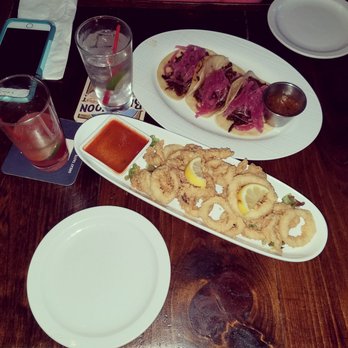
You are a GUI agent. You are given a task and a screenshot of the screen. Output one action in this format:
    pyautogui.click(x=<x>, y=<y>)
    Task: Click on the appetizer trays
    Image resolution: width=348 pixels, height=348 pixels.
    Given the screenshot: What is the action you would take?
    pyautogui.click(x=294, y=129), pyautogui.click(x=315, y=240)